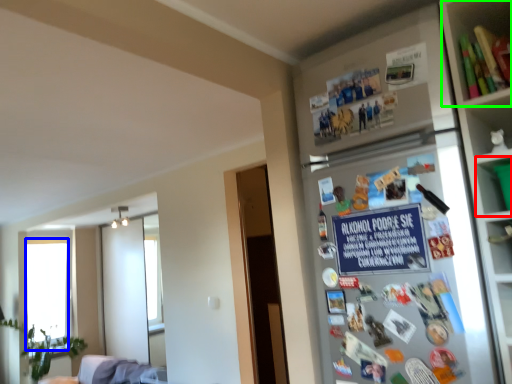
Question: Which object is the farthest from cabinet (highlighted by a red box)? Choose among these: window screen (highlighted by a blue box) or shelf (highlighted by a green box).

Choices:
 (A) window screen
 (B) shelf

Answer: (A)